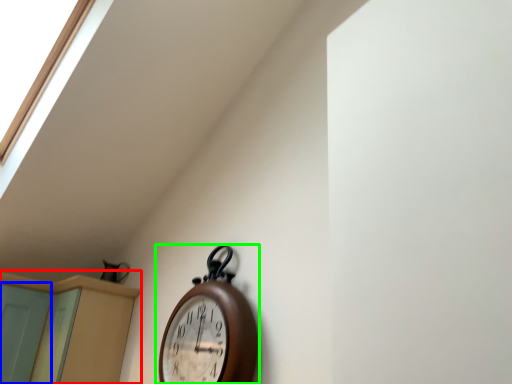
Question: Considering the real-world distances, which object is closest to dresser (highlighted by a red box)? screen door (highlighted by a blue box) or wall clock (highlighted by a green box).

Choices:
 (A) screen door
 (B) wall clock

Answer: (A)